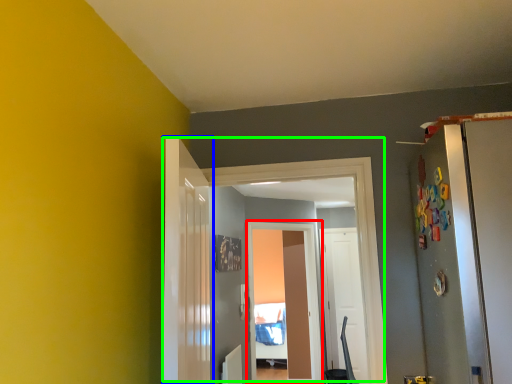
Question: Which object is the farthest from screen door (highlighted by a red box)? Choose among these: door (highlighted by a blue box) or door (highlighted by a green box).

Choices:
 (A) door
 (B) door

Answer: (A)